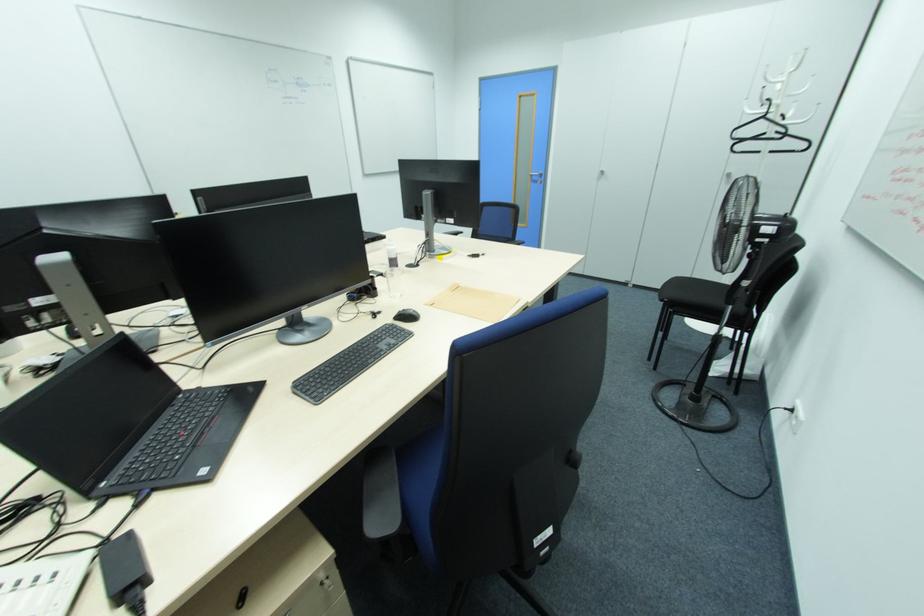
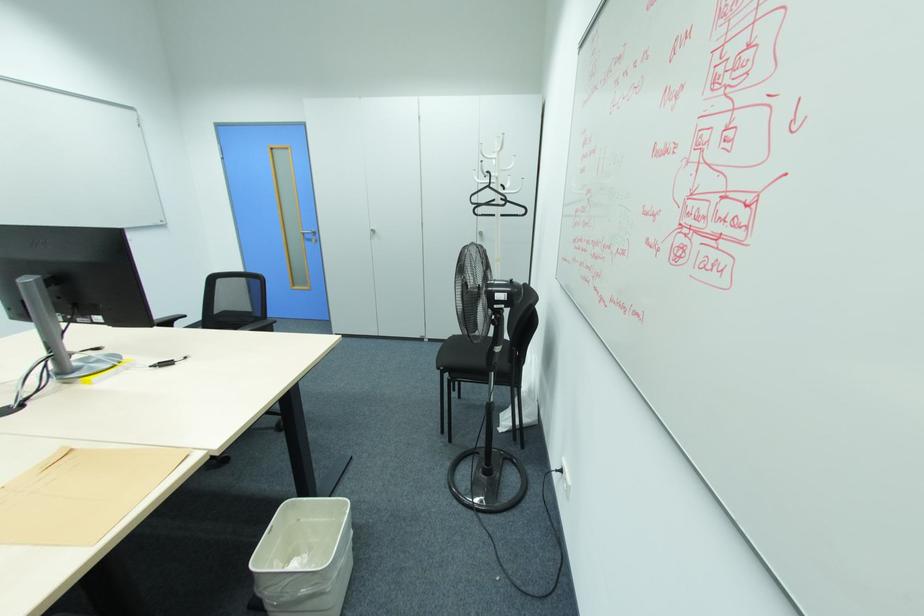
Question: I am providing you with two images of the same scene from different viewpoints. Please identify which objects are invisible in image2.

Choices:
 (A) white coat rack hook
 (B) brown paper folder
 (C) black clothes hanger
 (D) none of these

Answer: (D)